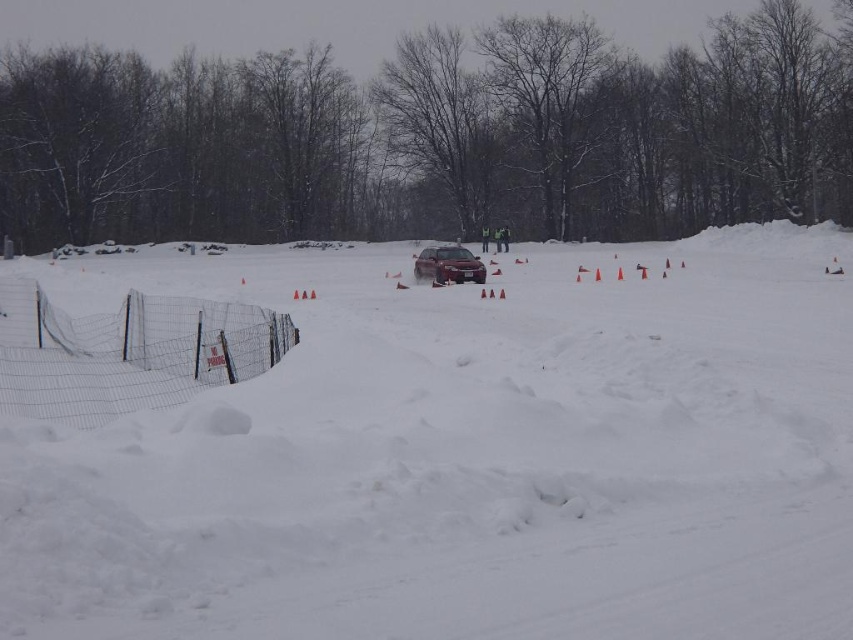
Who is positioned more to the right, white fluffy snow at center or wire mesh fence at lower left?

white fluffy snow at center is more to the right.

Is white fluffy snow at center above wire mesh fence at lower left?

Indeed, white fluffy snow at center is positioned over wire mesh fence at lower left.

At what (x,y) coordinates should I click in order to perform the action: click on white fluffy snow at center. Please return your answer as a coordinate pair (x, y). This screenshot has height=640, width=853. Looking at the image, I should click on click(x=465, y=456).

Locate an element on the screen. This screenshot has height=640, width=853. white fluffy snow at center is located at coordinates (465, 456).

What do you see at coordinates (126, 353) in the screenshot? Image resolution: width=853 pixels, height=640 pixels. I see `wire mesh fence at lower left` at bounding box center [126, 353].

Does wire mesh fence at lower left have a lesser height compared to satin silver sedan at center?

Indeed, wire mesh fence at lower left has a lesser height compared to satin silver sedan at center.

Measure the distance between point (144, 392) and camera.

They are 12.34 meters apart.

Where is `wire mesh fence at lower left`? wire mesh fence at lower left is located at coordinates (126, 353).

Is white fluffy snow at center positioned before satin silver sedan at center?

Yes, white fluffy snow at center is in front of satin silver sedan at center.

Which is behind, point (708, 445) or point (444, 275)?

The point (444, 275) is more distant.

Find the location of a particular element. The image size is (853, 640). white fluffy snow at center is located at coordinates (465, 456).